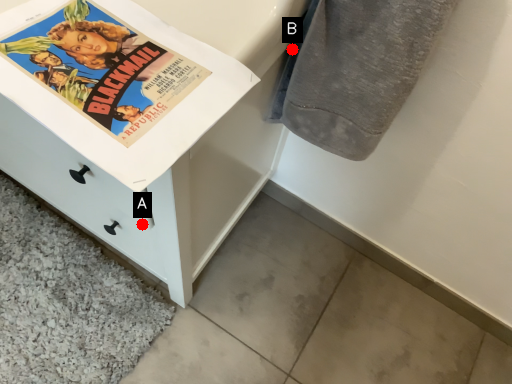
Question: Two points are circled on the image, labeled by A and B beside each circle. Which point appears closest to the camera in this image?

Choices:
 (A) A is closer
 (B) B is closer

Answer: (B)